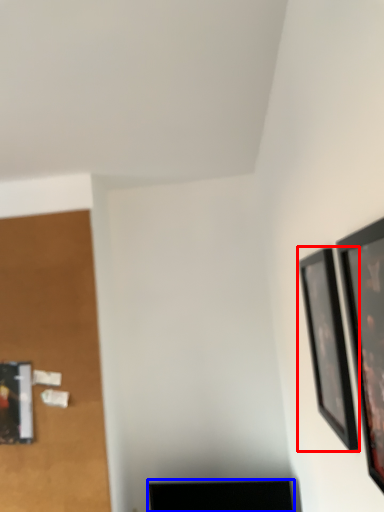
Question: Which of the following is the closest to the observer, picture frame (highlighted by a red box) or furniture (highlighted by a blue box)?

Choices:
 (A) picture frame
 (B) furniture

Answer: (A)